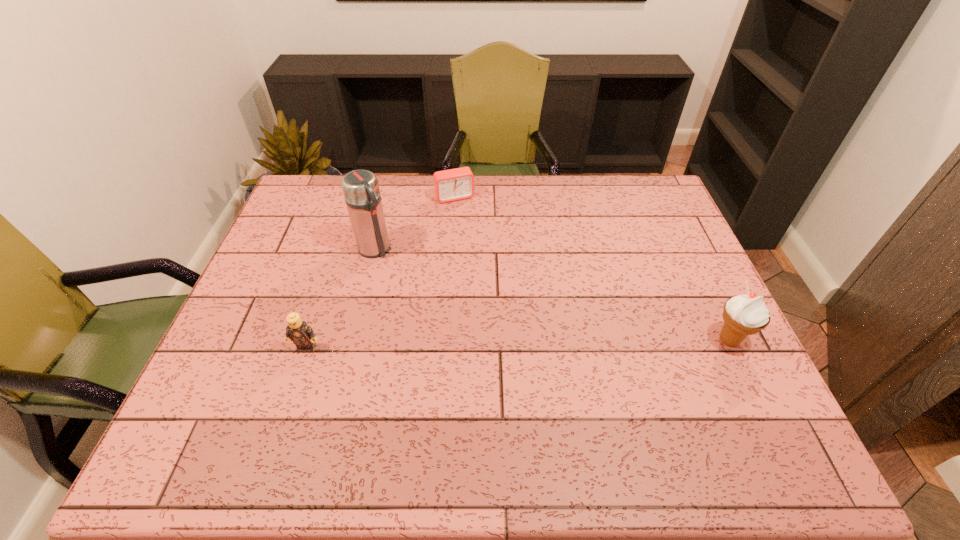
This screenshot has height=540, width=960. Identify the location of free spot between the second object from right to left and the tallest object. (415, 223).

Find the location of a particular element. Image resolution: width=960 pixels, height=540 pixels. free space that is in between the third tallest object and the alarm clock is located at coordinates (381, 273).

Where is `vacant area that lies between the leftmost object and the thermos bottle`? vacant area that lies between the leftmost object and the thermos bottle is located at coordinates (341, 299).

Where is `vacant point located between the shortest object and the third tallest object`? vacant point located between the shortest object and the third tallest object is located at coordinates (381, 273).

Locate an element on the screen. the closest object to the icecream is located at coordinates (450, 185).

Image resolution: width=960 pixels, height=540 pixels. I want to click on object that stands as the second closest to the Lego, so click(450, 185).

This screenshot has width=960, height=540. Identify the location of blank space that satisfies the following two spatial constraints: 1. on the front side of the icecream; 2. on the right side of the shortest object. (445, 340).

I want to click on vacant space that satisfies the following two spatial constraints: 1. on the front side of the rightmost object; 2. on the right side of the thermos bottle, so click(x=352, y=340).